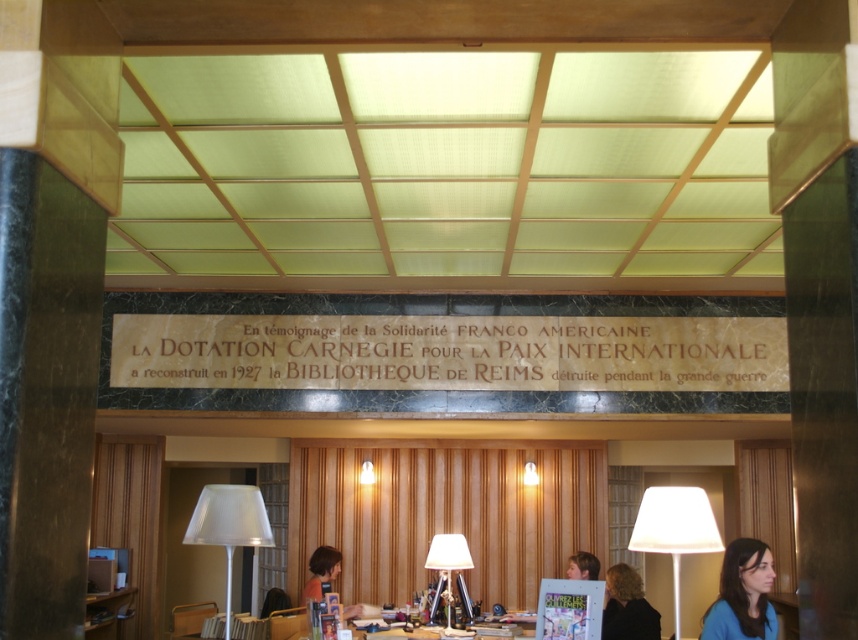
Question: Is blue matte shirt at lower right above matte white lampshade at center?

Choices:
 (A) yes
 (B) no

Answer: (A)

Question: Among these objects, which one is nearest to the camera?

Choices:
 (A) blue matte shirt at lower right
 (B) white translucent lampshade at lower left
 (C) matte white lampshade at center
 (D) white fabric lampshade at right

Answer: (D)

Question: Does white fabric lampshade at right have a larger size compared to white translucent lampshade at lower left?

Choices:
 (A) no
 (B) yes

Answer: (B)

Question: Which point appears farthest from the camera in this image?

Choices:
 (A) tap(671, 557)
 (B) tap(221, 490)

Answer: (A)

Question: Which point is closer to the camera?

Choices:
 (A) white fabric lampshade at right
 (B) blue matte shirt at lower right

Answer: (A)

Question: Is white translucent lampshade at lower left to the left of matte white lampshade at center from the viewer's perspective?

Choices:
 (A) no
 (B) yes

Answer: (B)